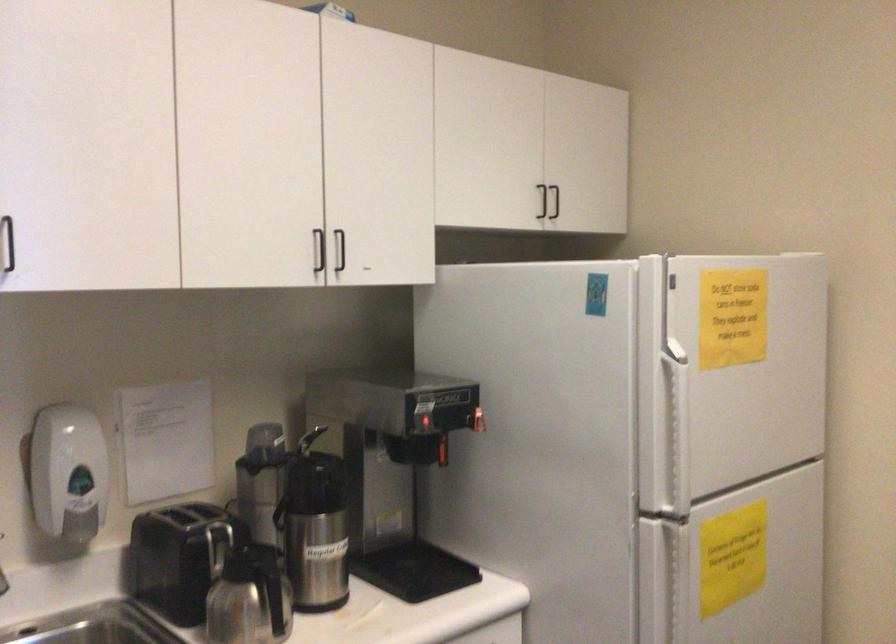
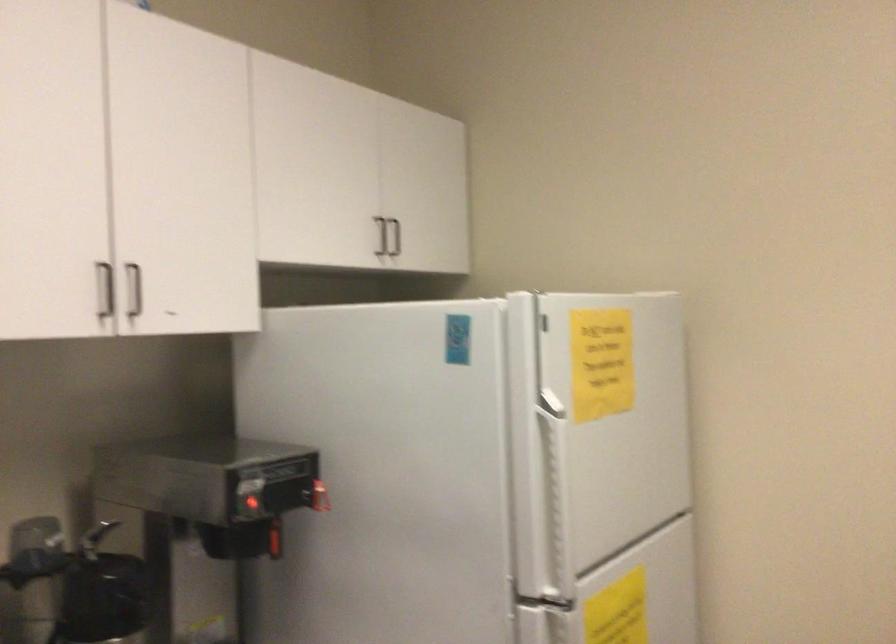
Question: How did the camera likely rotate?

Choices:
 (A) Left
 (B) Right
 (C) Up
 (D) Down

Answer: (B)